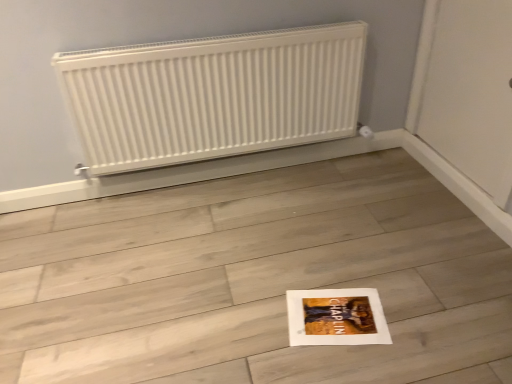
The height and width of the screenshot is (384, 512). What do you see at coordinates (255, 280) in the screenshot?
I see `white paper at center` at bounding box center [255, 280].

You are a GUI agent. You are given a task and a screenshot of the screen. Output one action in this format:
    pyautogui.click(x=<x>, y=<y>)
    Task: Click on the white paper at center
    
    Given the screenshot: What is the action you would take?
    pyautogui.click(x=255, y=280)

This screenshot has height=384, width=512. What do you see at coordinates (213, 95) in the screenshot? I see `white matte radiator at upper center` at bounding box center [213, 95].

Find the location of a particular element. The image size is (512, 384). white matte radiator at upper center is located at coordinates (213, 95).

Locate an element on the screen. The image size is (512, 384). white paper at center is located at coordinates (255, 280).

Is white paper at center at the left side of white matte radiator at upper center?

No, white paper at center is not to the left of white matte radiator at upper center.

Is the position of white paper at center less distant than that of white matte radiator at upper center?

Yes, white paper at center is in front of white matte radiator at upper center.

Between point (472, 378) and point (244, 46), which one is positioned in front?

The point (472, 378) is more forward.

From the image's perspective, which is below, white paper at center or white matte radiator at upper center?

From the image's view, white paper at center is below.

From a real-world perspective, which object rests below the other?

white paper at center.

In terms of width, does white paper at center look wider or thinner when compared to white matte radiator at upper center?

In the image, white paper at center appears to be wider than white matte radiator at upper center.

Who is shorter, white paper at center or white matte radiator at upper center?

white paper at center.

Is white paper at center bigger or smaller than white matte radiator at upper center?

Considering their sizes, white paper at center takes up more space than white matte radiator at upper center.

Is white matte radiator at upper center surrounded by white paper at center?

That's incorrect, white matte radiator at upper center is not inside white paper at center.

Is white paper at center with white matte radiator at upper center?

white paper at center is not next to white matte radiator at upper center, and they're not touching.

Is white paper at center turned away from white matte radiator at upper center?

That's not correct — white paper at center is not looking away from white matte radiator at upper center.

How distant is white paper at center from white matte radiator at upper center?

A distance of 21.17 inches exists between white paper at center and white matte radiator at upper center.

The image size is (512, 384). In order to click on tile below the white matte radiator at upper center (from a real-world perspective) in this screenshot , I will do `click(255, 280)`.

Is white matte radiator at upper center to the left of white paper at center from the viewer's perspective?

Indeed, white matte radiator at upper center is positioned on the left side of white paper at center.

Is white matte radiator at upper center further to camera compared to white paper at center?

Yes, white matte radiator at upper center is further from the viewer.

Does point (64, 92) lie behind point (17, 215)?

No, (64, 92) is in front of (17, 215).

From the image's perspective, which is below, white matte radiator at upper center or white paper at center?

white paper at center.

From a real-world perspective, is white matte radiator at upper center below white paper at center?

No, from a real-world perspective, white matte radiator at upper center is not under white paper at center.

Between white matte radiator at upper center and white paper at center, which one has smaller width?

Answer: Thinner between the two is white matte radiator at upper center.

Between white matte radiator at upper center and white paper at center, which one has less height?

white paper at center is shorter.

Who is smaller, white matte radiator at upper center or white paper at center?

white matte radiator at upper center is smaller.

Is white matte radiator at upper center completely or partially outside of white paper at center?

Yes, white matte radiator at upper center is not within white paper at center.

Would you say white matte radiator at upper center is a long distance from white paper at center?

Actually, white matte radiator at upper center and white paper at center are a little close together.

Is white paper at center at the back of white matte radiator at upper center?

No, white paper at center is not at the back of white matte radiator at upper center.

How many degrees apart are the facing directions of white matte radiator at upper center and white paper at center?

The angle between the facing direction of white matte radiator at upper center and the facing direction of white paper at center is 89.3 degrees.

Where is `radiator on the left of white paper at center`? The height and width of the screenshot is (384, 512). radiator on the left of white paper at center is located at coordinates (213, 95).

Where is `tile below the white matte radiator at upper center (from a real-world perspective)`? tile below the white matte radiator at upper center (from a real-world perspective) is located at coordinates (255, 280).

Locate an element on the screen. The image size is (512, 384). radiator behind the white paper at center is located at coordinates tap(213, 95).